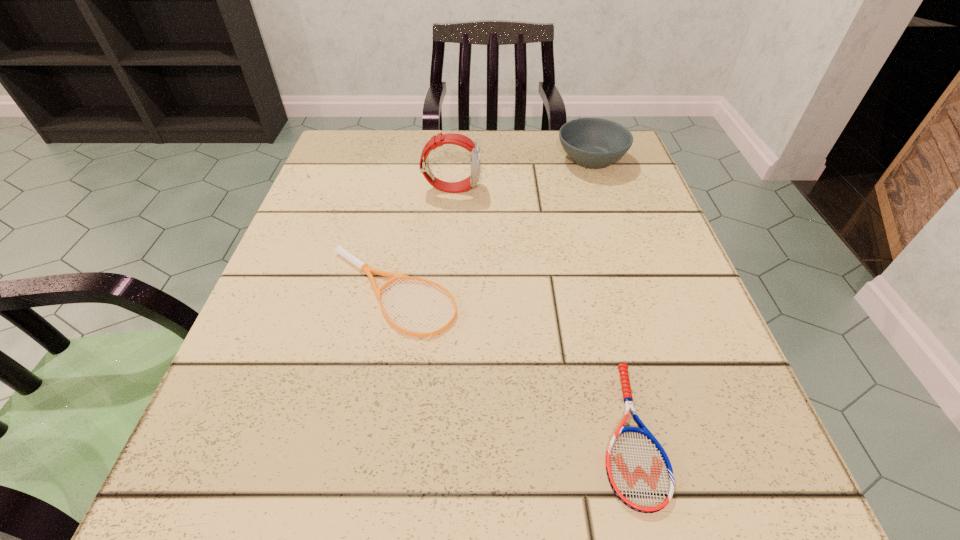
Identify the location of watch. The image size is (960, 540). (452, 138).

The width and height of the screenshot is (960, 540). I want to click on soup bowl, so coord(594,143).

The width and height of the screenshot is (960, 540). I want to click on the second nearest object, so click(x=340, y=250).

You are a GUI agent. You are given a task and a screenshot of the screen. Output one action in this format:
    pyautogui.click(x=<x>, y=<y>)
    Task: Click on the left tennis racket
    Image resolution: width=960 pixels, height=540 pixels.
    Given the screenshot: What is the action you would take?
    pyautogui.click(x=340, y=250)

The height and width of the screenshot is (540, 960). Find the location of `the nearest object`. the nearest object is located at coordinates 639,471.

Identify the location of the nearer tennis racket. The width and height of the screenshot is (960, 540). (639, 471).

Locate an element on the screen. This screenshot has width=960, height=540. vacant space positioned on the face of the watch is located at coordinates (557, 188).

Where is `vacant area situated on the front of the soup bowl`? The image size is (960, 540). vacant area situated on the front of the soup bowl is located at coordinates (640, 307).

Find the location of a particular element. vacant space located 0.220m on the right of the farther tennis racket is located at coordinates (602, 294).

I want to click on free region located on the left of the nearer tennis racket, so click(415, 432).